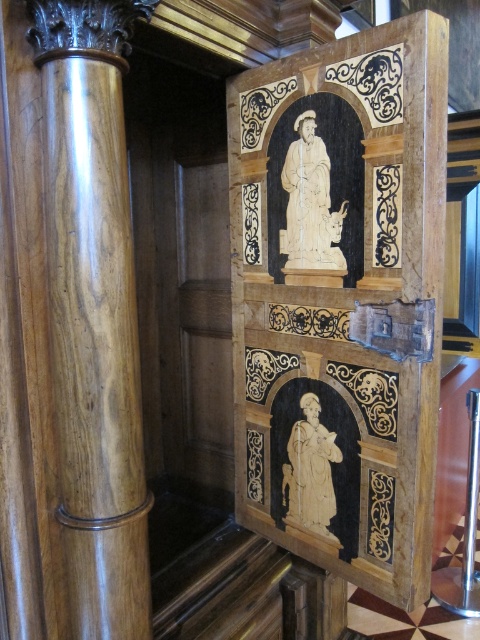
Question: Is white carved wood statue at center to the left of ivory statue at lower center from the viewer's perspective?

Choices:
 (A) yes
 (B) no

Answer: (A)

Question: Which point is farther to the camera?

Choices:
 (A) ivory statue at lower center
 (B) white carved wood statue at center
 (C) polished wood column at left
 (D) marble panel at center

Answer: (A)

Question: Considering the relative positions of white carved wood statue at center and ivory statue at lower center in the image provided, where is white carved wood statue at center located with respect to ivory statue at lower center?

Choices:
 (A) above
 (B) below

Answer: (A)

Question: Based on their relative distances, which object is nearer to the polished wood column at left?

Choices:
 (A) ivory statue at lower center
 (B) white carved wood statue at center
 (C) marble panel at center

Answer: (C)

Question: Is polished wood column at left positioned at the back of ivory statue at lower center?

Choices:
 (A) no
 (B) yes

Answer: (A)

Question: Which object is farther from the camera taking this photo?

Choices:
 (A) polished wood column at left
 (B) white carved wood statue at center
 (C) ivory statue at lower center

Answer: (C)